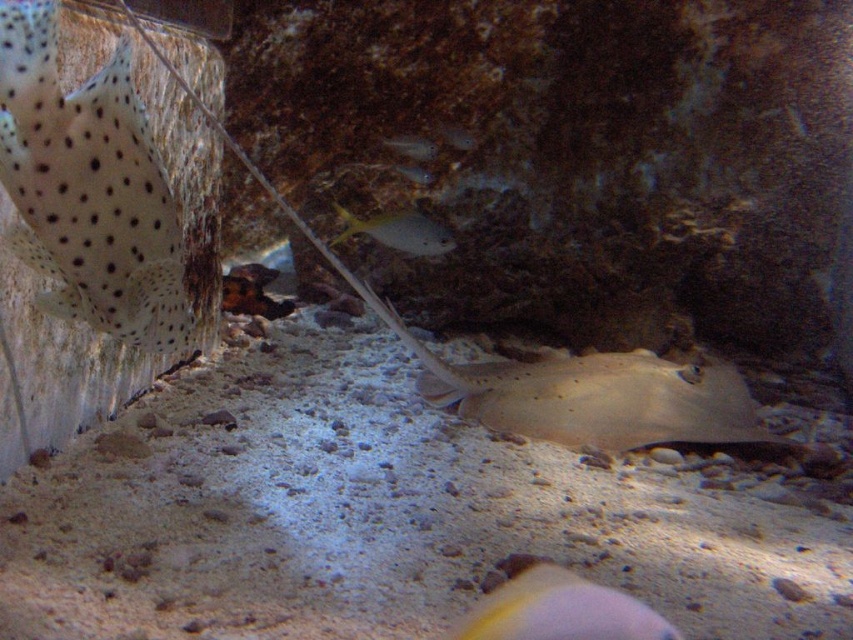
Looking at this image, is spotted white at left shorter than smooth yellow fish at lower center?

Incorrect, spotted white at left's height does not fall short of smooth yellow fish at lower center's.

Does point (85, 90) lie behind point (579, 609)?

That is True.

I want to click on spotted white at left, so click(88, 188).

Does point (677, 376) come in front of point (418, 136)?

Yes, point (677, 376) is closer to viewer.

Who is higher up, light beige smooth stingray at center or shiny silver fish at center?

Positioned higher is shiny silver fish at center.

Between point (587, 433) and point (421, 145), which one is positioned in front?

Positioned in front is point (587, 433).

Locate an element on the screen. light beige smooth stingray at center is located at coordinates (602, 401).

Is light beige smooth stingray at center bigger than yellow shiny fish at center?

Correct, light beige smooth stingray at center is larger in size than yellow shiny fish at center.

Can you confirm if light beige smooth stingray at center is positioned below yellow shiny fish at center?

Yes, light beige smooth stingray at center is below yellow shiny fish at center.

This screenshot has height=640, width=853. I want to click on light beige smooth stingray at center, so click(602, 401).

Find the location of a particular element. The height and width of the screenshot is (640, 853). light beige smooth stingray at center is located at coordinates (602, 401).